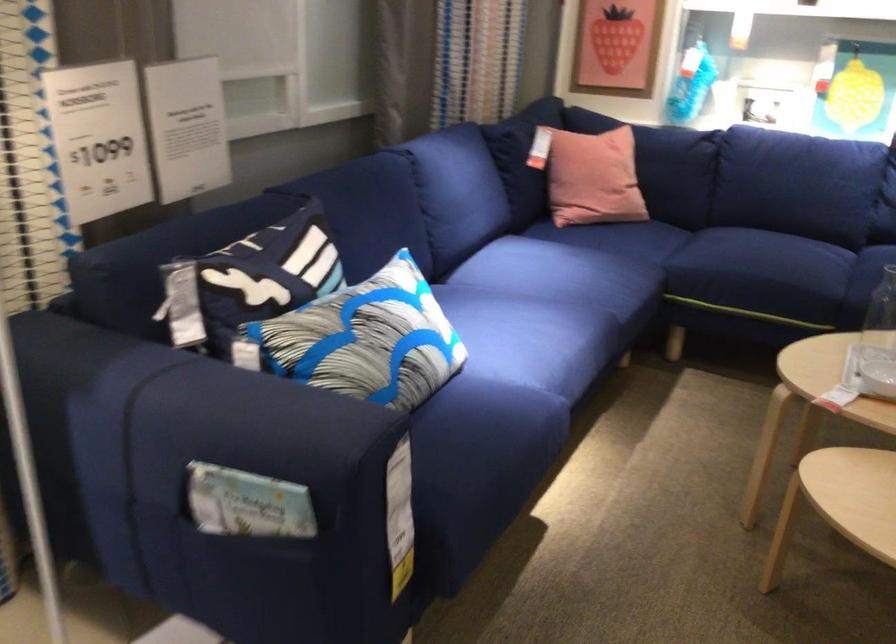
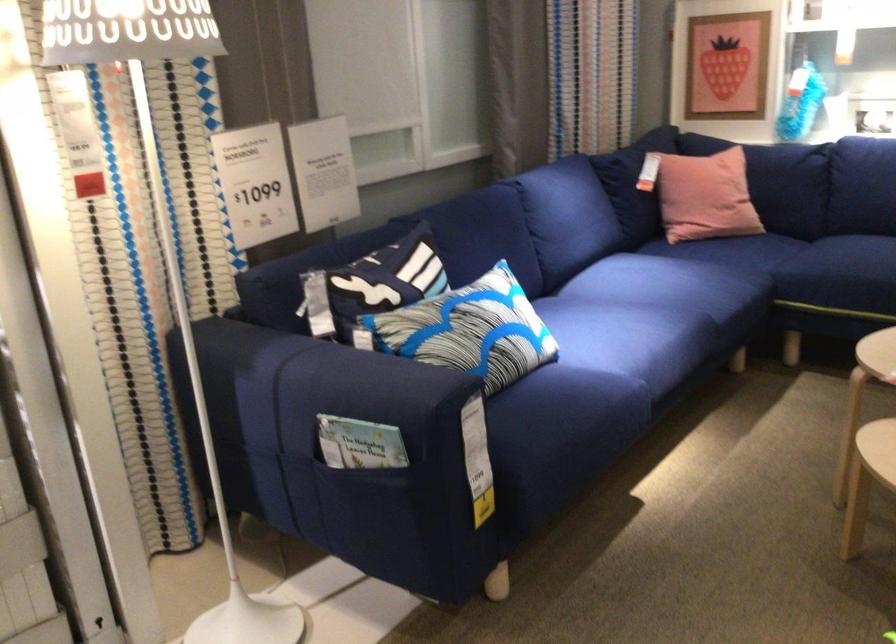
In the second image, find the point that corresponds to point 576,304 in the first image.

(676, 303)